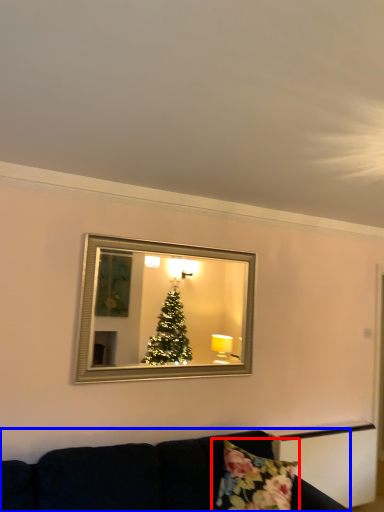
Question: Which point is further to the camera, pillow (highlighted by a red box) or studio couch (highlighted by a blue box)?

Choices:
 (A) pillow
 (B) studio couch

Answer: (A)